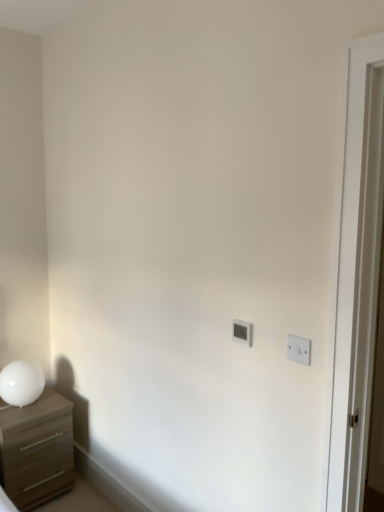
Question: Can you confirm if white plastic light switch at center, positioned as the 1th light switch in left-to-right order, is smaller than white plastic light switch at upper right, which appears as the second light switch when viewed from the left?

Choices:
 (A) no
 (B) yes

Answer: (A)

Question: Is white plastic light switch at center, which appears as the second light switch when viewed from the front, facing away from white plastic light switch at upper right, which is the 2th light switch in back-to-front order?

Choices:
 (A) no
 (B) yes

Answer: (A)

Question: Does white plastic light switch at center, the first light switch when ordered from back to front, have a lesser width compared to white plastic light switch at upper right, marked as the first light switch in a right-to-left arrangement?

Choices:
 (A) no
 (B) yes

Answer: (A)

Question: Is white plastic light switch at center, which appears as the second light switch when viewed from the front, to the left of white plastic light switch at upper right, the first light switch when ordered from front to back, from the viewer's perspective?

Choices:
 (A) yes
 (B) no

Answer: (A)

Question: From the image's perspective, is white plastic light switch at center, the first light switch when ordered from back to front, located above white plastic light switch at upper right, the first light switch when ordered from front to back?

Choices:
 (A) yes
 (B) no

Answer: (A)

Question: Is white plastic light switch at center, which appears as the second light switch when viewed from the front, bigger than white plastic light switch at upper right, which is the 2th light switch in back-to-front order?

Choices:
 (A) yes
 (B) no

Answer: (A)

Question: Is white plastic light switch at center, the first light switch when ordered from back to front, not inside white glossy table lamp at left?

Choices:
 (A) yes
 (B) no

Answer: (A)

Question: Is white plastic light switch at center, arranged as the second light switch when viewed from the right, far from white glossy table lamp at left?

Choices:
 (A) no
 (B) yes

Answer: (B)

Question: Can white glossy table lamp at left be found inside white plastic light switch at center, which appears as the second light switch when viewed from the front?

Choices:
 (A) yes
 (B) no

Answer: (B)

Question: Can you confirm if white plastic light switch at center, the first light switch when ordered from back to front, is bigger than white glossy table lamp at left?

Choices:
 (A) yes
 (B) no

Answer: (B)

Question: Considering the relative positions of white plastic light switch at center, the first light switch when ordered from back to front, and white glossy table lamp at left in the image provided, is white plastic light switch at center, the first light switch when ordered from back to front, behind white glossy table lamp at left?

Choices:
 (A) no
 (B) yes

Answer: (A)

Question: From the image's perspective, is white plastic light switch at center, the first light switch when ordered from back to front, beneath white glossy table lamp at left?

Choices:
 (A) no
 (B) yes

Answer: (A)

Question: Is white plastic light switch at upper right, which is the 2th light switch in back-to-front order, closer to the viewer compared to white glossy table lamp at left?

Choices:
 (A) yes
 (B) no

Answer: (A)